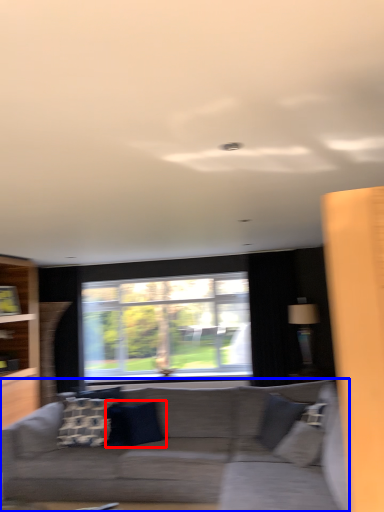
Question: Which point is closer to the camera, pillow (highlighted by a red box) or studio couch (highlighted by a blue box)?

Choices:
 (A) pillow
 (B) studio couch

Answer: (B)